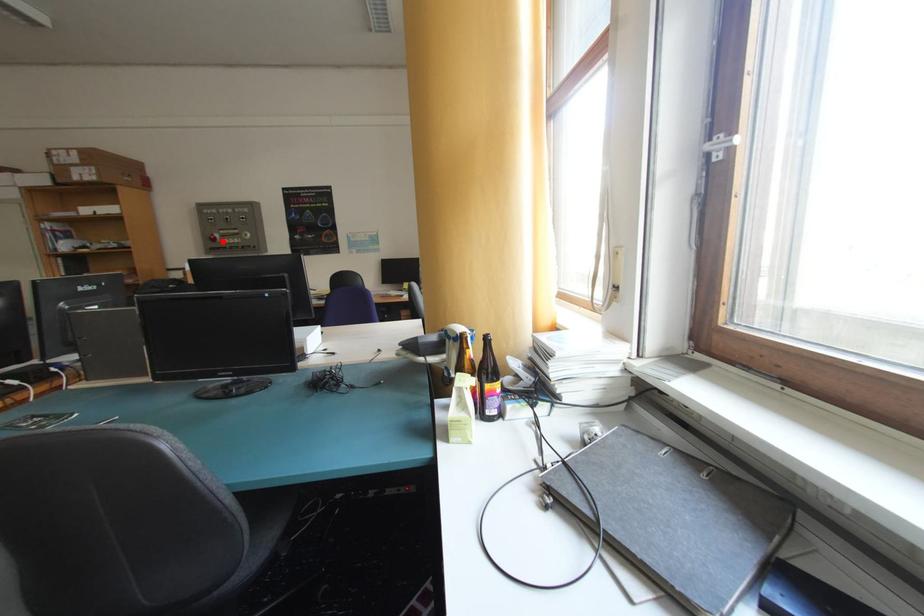
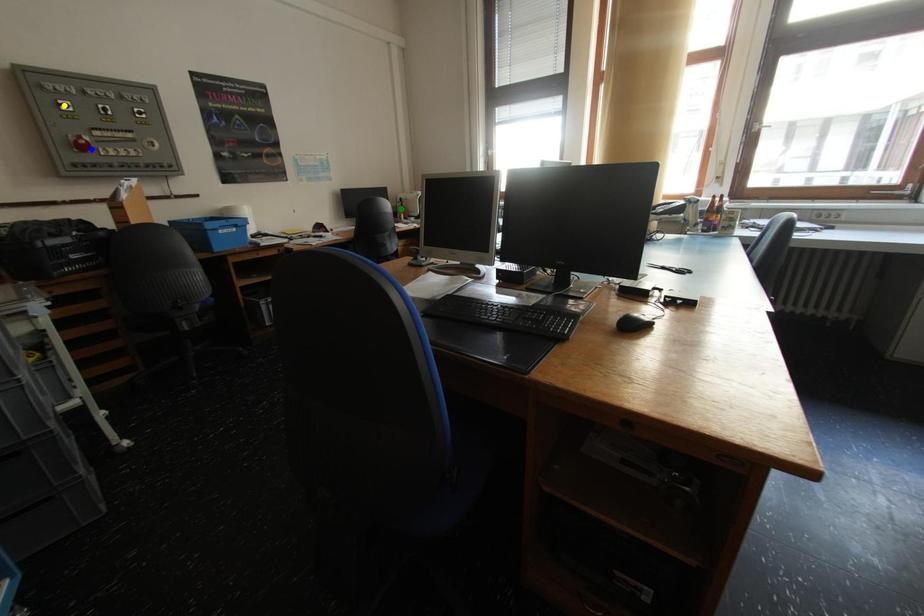
Question: I am providing you with two images of the same scene from different viewpoints. A red point is marked on the first image. You are given multiple points on the second image. Which point in image 2 represents the same 3d spot as the red point in image 1?

Choices:
 (A) green point
 (B) blue point
 (C) yellow point

Answer: (B)